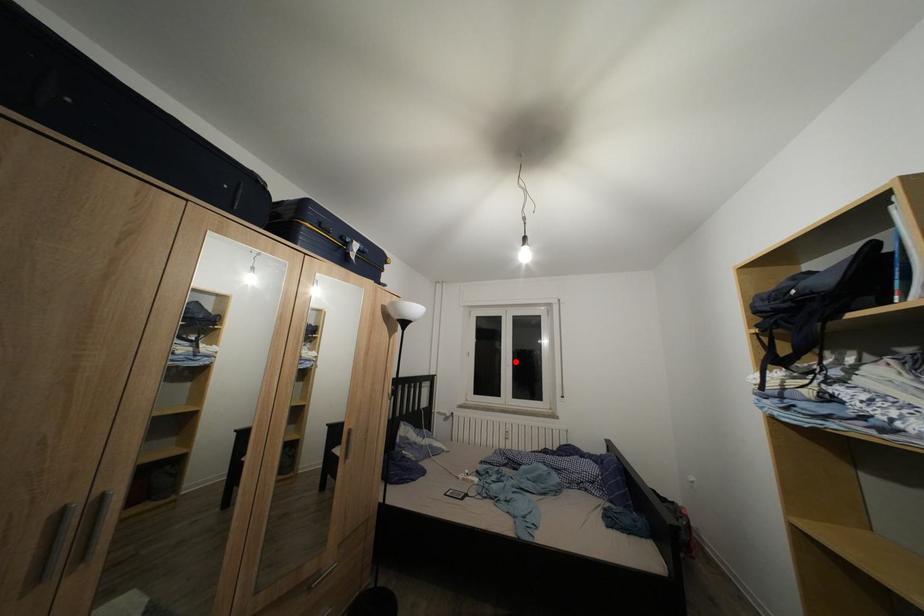
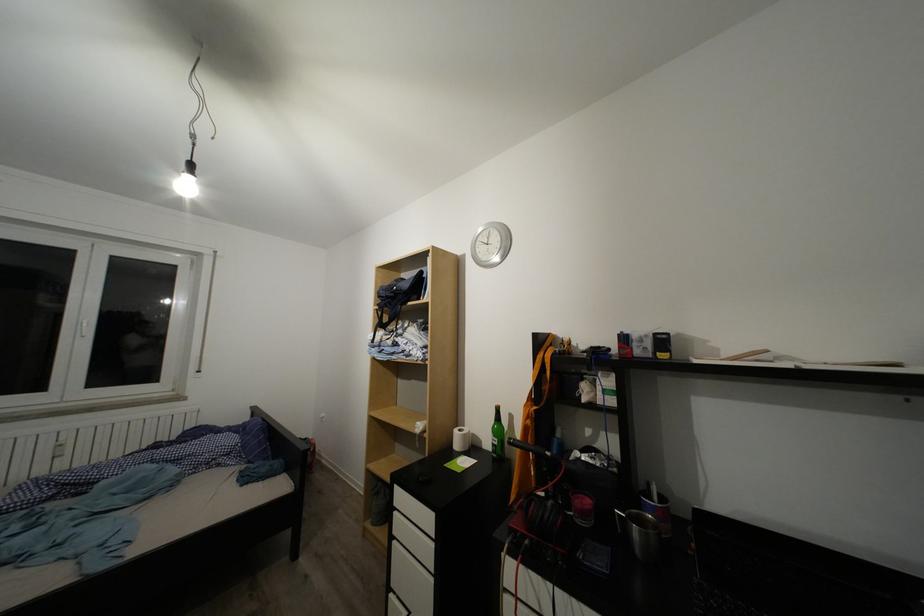
Where in the second image is the point corresponding to the highlighted location from the first image?

(90, 325)